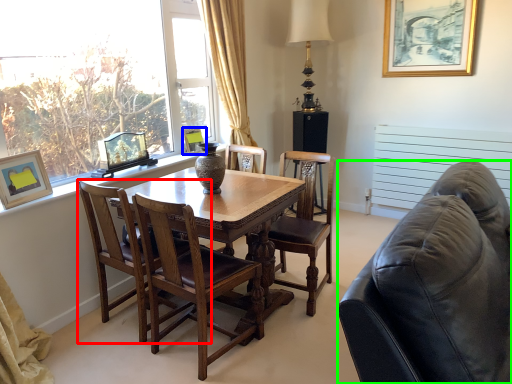
Question: Which object is the closest to the chair (highlighted by a red box)? Choose among these: picture frame (highlighted by a blue box) or studio couch (highlighted by a green box).

Choices:
 (A) picture frame
 (B) studio couch

Answer: (A)